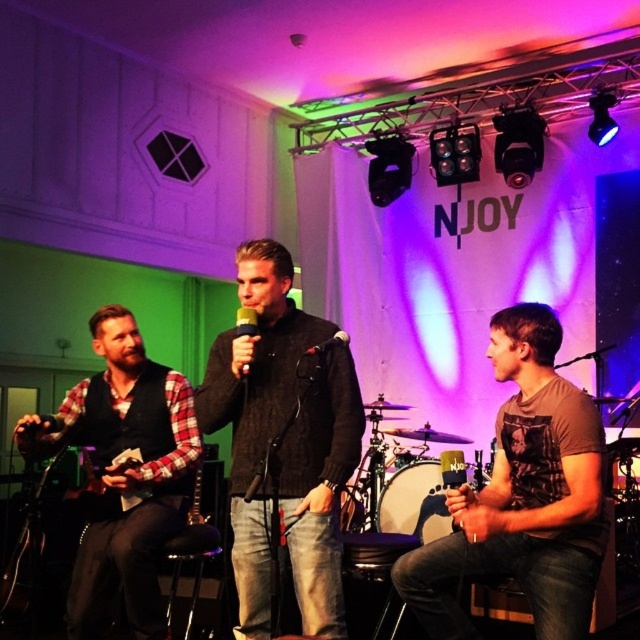
Question: Does black knit sweater at center come in front of metallic silver microphone at center?

Choices:
 (A) yes
 (B) no

Answer: (A)

Question: Where is dark gray sweater at center located in relation to metallic silver microphone at center in the image?

Choices:
 (A) below
 (B) above

Answer: (A)

Question: Where is metallic silver microphone at center located in relation to black matte microphone at center in the image?

Choices:
 (A) above
 (B) below

Answer: (A)

Question: Estimate the real-world distances between objects in this image. Which object is closer to the black matte microphone at center?

Choices:
 (A) dark gray sweater at center
 (B) black knit sweater at center

Answer: (A)

Question: Which point appears farthest from the camera in this image?

Choices:
 (A) (321, 476)
 (B) (348, 353)
 (C) (257, 332)

Answer: (B)

Question: Which point is farther from the camera taking this photo?

Choices:
 (A) pos(557,636)
 (B) pos(339,340)
 (C) pos(243,456)
 (D) pos(241,353)

Answer: (C)